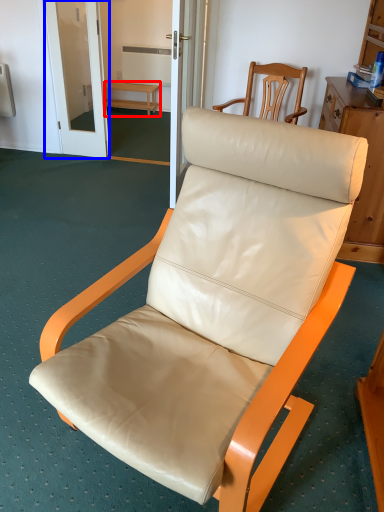
Question: Which object appears closest to the camera in this image, furniture (highlighted by a red box) or screen door (highlighted by a blue box)?

Choices:
 (A) furniture
 (B) screen door

Answer: (B)